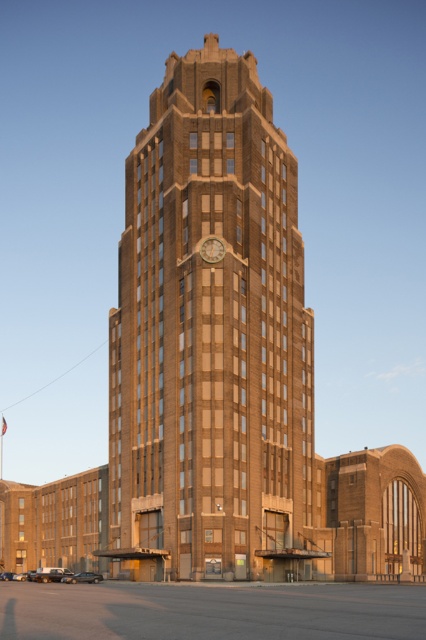
Question: Among these points, which one is nearest to the camera?

Choices:
 (A) (221, 252)
 (B) (293, 172)

Answer: (A)

Question: Considering the relative positions of brown brick tower at center and wooden clock at center in the image provided, where is brown brick tower at center located with respect to wooden clock at center?

Choices:
 (A) right
 (B) left

Answer: (A)

Question: Is brown brick tower at center above wooden clock at center?

Choices:
 (A) no
 (B) yes

Answer: (A)

Question: Considering the relative positions of brown brick tower at center and wooden clock at center in the image provided, where is brown brick tower at center located with respect to wooden clock at center?

Choices:
 (A) right
 (B) left

Answer: (A)

Question: Which of the following is the closest to the observer?

Choices:
 (A) (218, 243)
 (B) (160, 403)

Answer: (A)